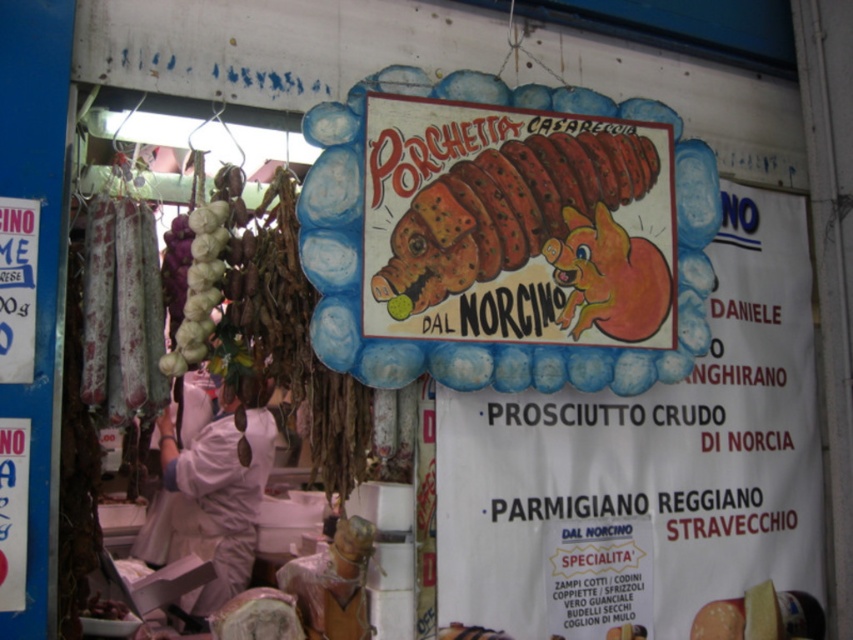
Question: Which point is closer to the camera?

Choices:
 (A) (492, 161)
 (B) (747, 243)

Answer: (A)

Question: Does matte orange pig at center appear over sliced brown meat at center?

Choices:
 (A) no
 (B) yes

Answer: (A)

Question: Is matte orange pig at center closer to the viewer compared to sliced brown meat at center?

Choices:
 (A) no
 (B) yes

Answer: (A)

Question: Is matte orange pig at center positioned before sliced brown meat at center?

Choices:
 (A) yes
 (B) no

Answer: (B)

Question: Which of the following is the closest to the observer?

Choices:
 (A) (514, 198)
 (B) (753, 188)

Answer: (A)

Question: Which point appears closest to the camera in this image?

Choices:
 (A) (778, 509)
 (B) (402, 275)

Answer: (B)